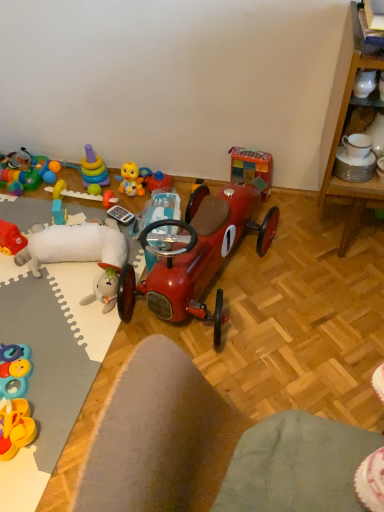
Where is `vacant space to the left of wooden cabinet at right`? The image size is (384, 512). vacant space to the left of wooden cabinet at right is located at coordinates (288, 242).